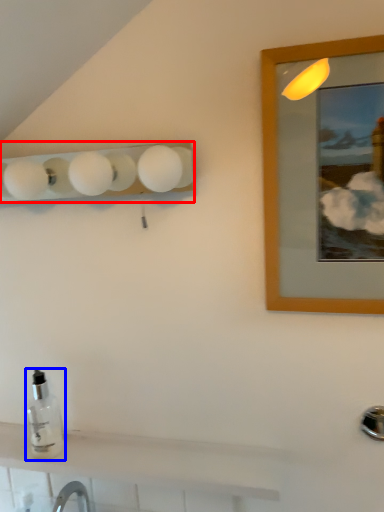
Question: Which of the following is the farthest to the observer, lamp (highlighted by a red box) or bottle (highlighted by a blue box)?

Choices:
 (A) lamp
 (B) bottle

Answer: (B)